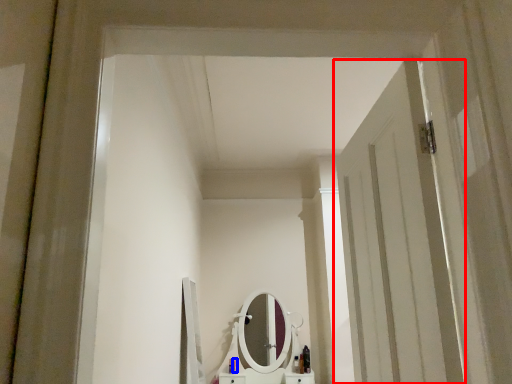
Question: Among these objects, which one is farthest to the camera, door (highlighted by a red box) or toiletry (highlighted by a blue box)?

Choices:
 (A) door
 (B) toiletry

Answer: (B)